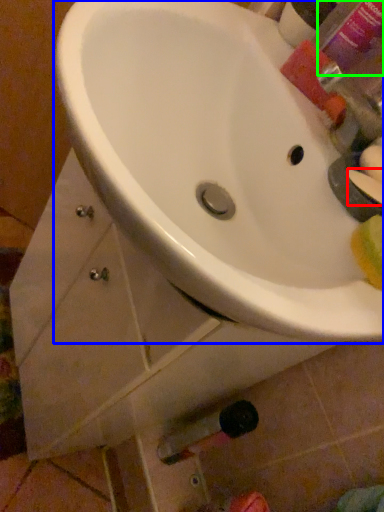
Question: Based on their relative distances, which object is nearer to soap (highlighted by a red box)? Choose from sink (highlighted by a blue box) and mouthwash (highlighted by a green box).

Choices:
 (A) sink
 (B) mouthwash

Answer: (A)